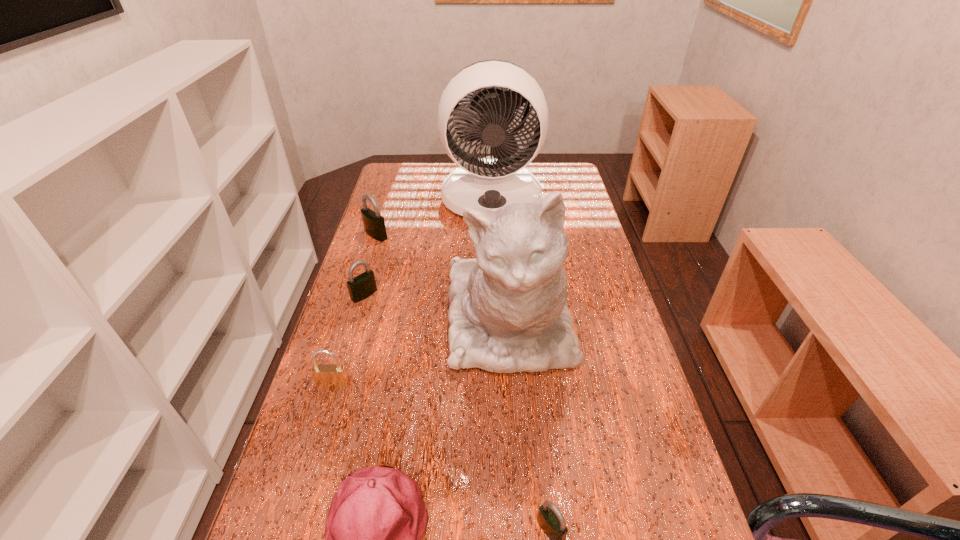
In the image, there is a desktop. At what (x,y) coordinates should I click in order to perform the action: click on vacant space at the far left corner. Please return your answer as a coordinate pair (x, y). This screenshot has height=540, width=960. Looking at the image, I should click on (404, 164).

Locate an element on the screen. The image size is (960, 540). vacant space at the far right corner is located at coordinates point(570,173).

Where is `vacant area that lies between the brass padlock and the second smallest black padlock`? vacant area that lies between the brass padlock and the second smallest black padlock is located at coordinates (348, 340).

Select which object appears as the second closest to the cat. Please provide its 2D coordinates. Your answer should be formatted as a tuple, i.e. [(x, y)], where the tuple contains the x and y coordinates of a point satisfying the conditions above.

[(362, 286)]

Locate an element on the screen. The width and height of the screenshot is (960, 540). the second closest object to the second smallest black padlock is located at coordinates (374, 225).

Choose which padlock is the fourth nearest neighbor to the red baseball cap. Please provide its 2D coordinates. Your answer should be formatted as a tuple, i.e. [(x, y)], where the tuple contains the x and y coordinates of a point satisfying the conditions above.

[(374, 225)]

This screenshot has height=540, width=960. I want to click on padlock that can be found as the second closest to the red baseball cap, so click(x=551, y=520).

Locate an element on the screen. Image resolution: width=960 pixels, height=540 pixels. black padlock identified as the closest to the shortest padlock is located at coordinates (362, 286).

The width and height of the screenshot is (960, 540). Identify the location of black padlock that stands as the second closest to the shortest object. (374, 225).